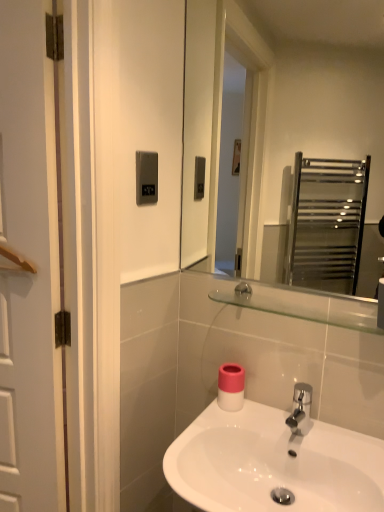
Question: From a real-world perspective, is white glossy sink at center over clear glass mirror at upper center?

Choices:
 (A) yes
 (B) no

Answer: (B)

Question: Is white glossy sink at center with clear glass mirror at upper center?

Choices:
 (A) no
 (B) yes

Answer: (A)

Question: Is white glossy sink at center to the right of clear glass mirror at upper center from the viewer's perspective?

Choices:
 (A) no
 (B) yes

Answer: (A)

Question: Does white glossy sink at center contain clear glass mirror at upper center?

Choices:
 (A) no
 (B) yes

Answer: (A)

Question: Is white glossy sink at center turned away from clear glass mirror at upper center?

Choices:
 (A) no
 (B) yes

Answer: (A)

Question: Is clear glass mirror at upper center spatially inside satin silver panel at upper center, or outside of it?

Choices:
 (A) inside
 (B) outside

Answer: (B)

Question: In the image, is clear glass mirror at upper center on the left side or the right side of satin silver panel at upper center?

Choices:
 (A) left
 (B) right

Answer: (B)

Question: Considering the positions of clear glass mirror at upper center and satin silver panel at upper center in the image, is clear glass mirror at upper center taller or shorter than satin silver panel at upper center?

Choices:
 (A) tall
 (B) short

Answer: (A)

Question: In terms of width, does clear glass mirror at upper center look wider or thinner when compared to satin silver panel at upper center?

Choices:
 (A) wide
 (B) thin

Answer: (A)

Question: Looking at their shapes, would you say satin silver panel at upper center is wider or thinner than white glossy sink at center?

Choices:
 (A) wide
 (B) thin

Answer: (B)

Question: Considering the positions of satin silver panel at upper center and white glossy sink at center in the image, is satin silver panel at upper center bigger or smaller than white glossy sink at center?

Choices:
 (A) small
 (B) big

Answer: (A)

Question: From a real-world perspective, relative to white glossy sink at center, is satin silver panel at upper center vertically above or below?

Choices:
 (A) above
 (B) below

Answer: (A)

Question: Is satin silver panel at upper center situated inside white glossy sink at center or outside?

Choices:
 (A) outside
 (B) inside

Answer: (A)

Question: Considering the positions of clear glass mirror at upper center and clear glass shelf at upper center in the image, is clear glass mirror at upper center bigger or smaller than clear glass shelf at upper center?

Choices:
 (A) big
 (B) small

Answer: (A)

Question: From a real-world perspective, is clear glass mirror at upper center positioned above or below clear glass shelf at upper center?

Choices:
 (A) below
 (B) above

Answer: (B)